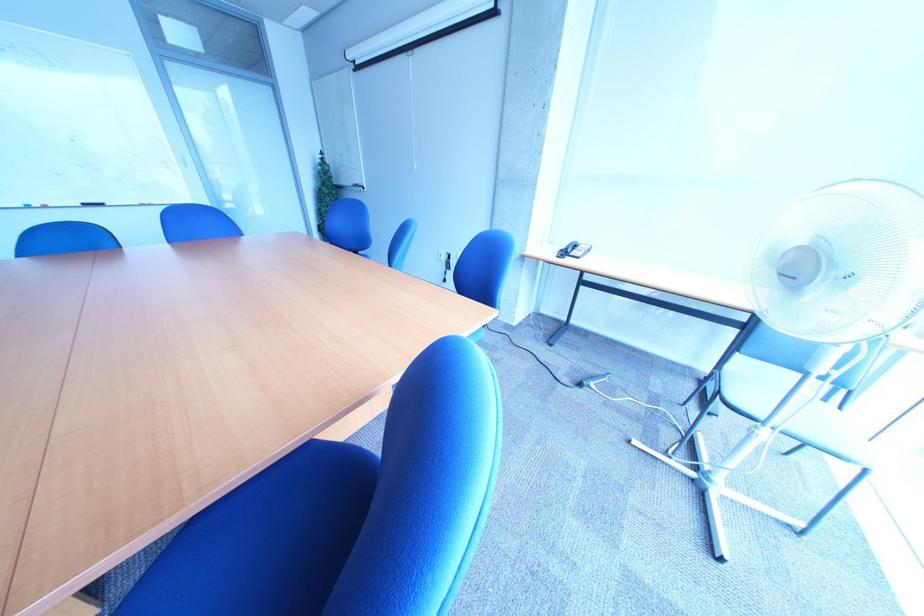
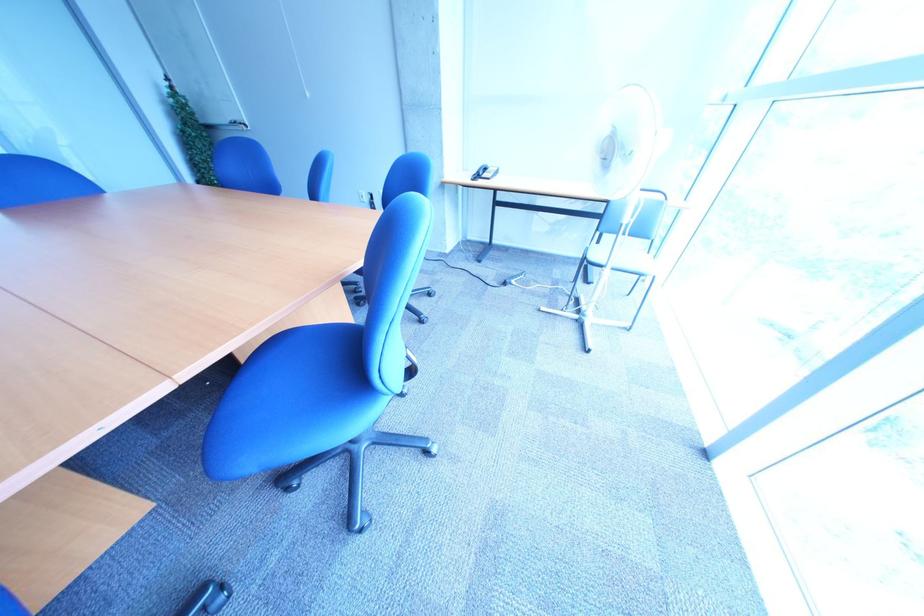
Question: The camera is either moving clockwise (left) or counter-clockwise (right) around the object. The first image is from the beginning of the video and the second image is from the end. Is the camera moving left or right when shooting the video?

Choices:
 (A) Left
 (B) Right

Answer: (A)